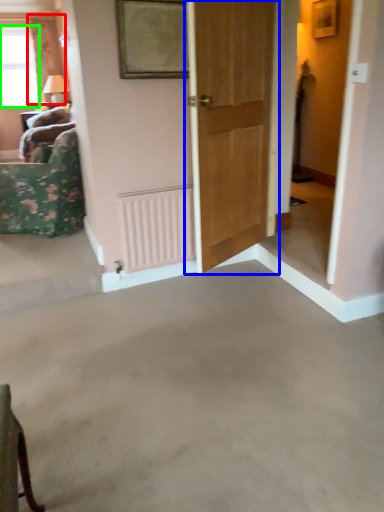
Question: Which object is positioned farthest from curtain (highlighted by a red box)? Select from door (highlighted by a blue box) and window (highlighted by a green box).

Choices:
 (A) door
 (B) window

Answer: (A)